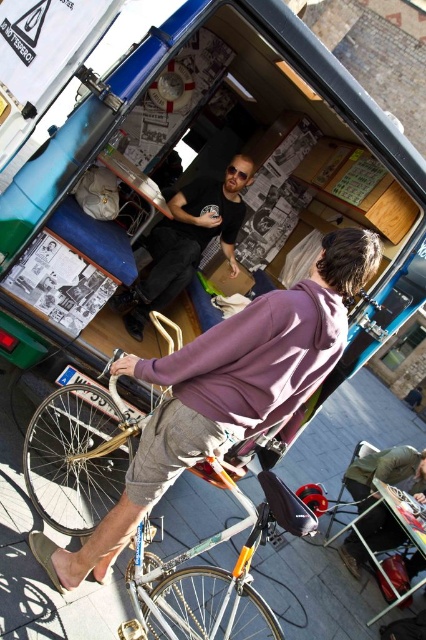
Can you confirm if black matte t-shirt at center is shorter than light brown leather jacket at lower right?

No.

Does black matte t-shirt at center appear over light brown leather jacket at lower right?

Correct, black matte t-shirt at center is located above light brown leather jacket at lower right.

Identify the location of black matte t-shirt at center. (187, 241).

Does silver metallic bicycle at lower left have a lesser width compared to black matte t-shirt at center?

Indeed, silver metallic bicycle at lower left has a lesser width compared to black matte t-shirt at center.

Is point (276, 506) farther from camera compared to point (236, 156)?

No, (276, 506) is closer to viewer.

Describe the element at coordinates (78, 454) in the screenshot. I see `silver metallic bicycle at lower left` at that location.

You are a GUI agent. You are given a task and a screenshot of the screen. Output one action in this format:
    pyautogui.click(x=<x>, y=<y>)
    Task: Click on the silver metallic bicycle at lower left
    
    Given the screenshot: What is the action you would take?
    pyautogui.click(x=78, y=454)

Is silver metallic bicycle at lower left above light brown leather jacket at lower right?

Indeed, silver metallic bicycle at lower left is positioned over light brown leather jacket at lower right.

Could you measure the distance between silver metallic bicycle at lower left and light brown leather jacket at lower right?

A distance of 13.29 feet exists between silver metallic bicycle at lower left and light brown leather jacket at lower right.

Who is more distant from viewer, (75, 422) or (414, 472)?

The point (414, 472) is behind.

Locate an element on the screen. This screenshot has height=640, width=426. silver metallic bicycle at lower left is located at coordinates (78, 454).